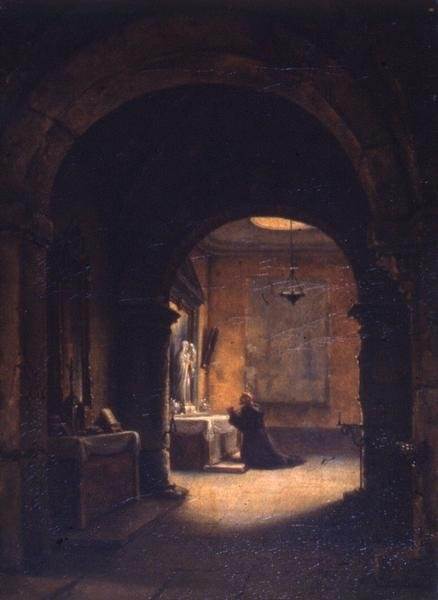
I want to click on candles, so click(191, 406), click(186, 405).